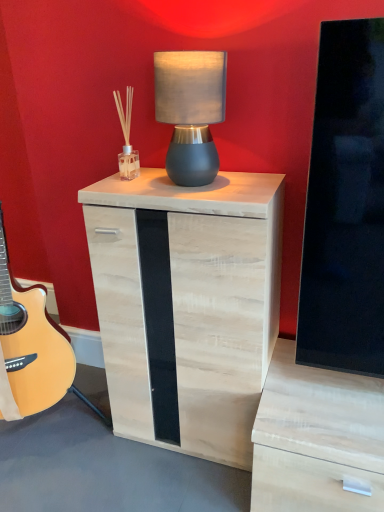
Identify the location of vacant area that is in front of matte gray lampshade at center. Image resolution: width=384 pixels, height=512 pixels. (211, 193).